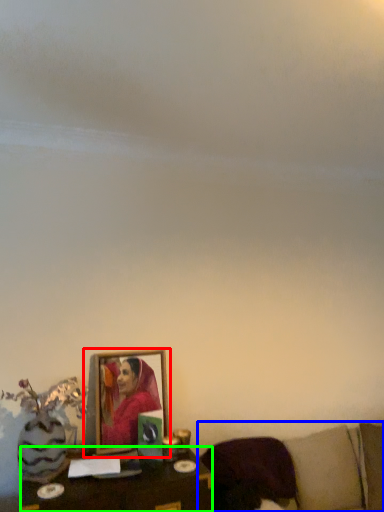
Question: Estimate the real-world distances between objects in this image. Which object is closer to picture frame (highlighted by a red box), furniture (highlighted by a blue box) or table (highlighted by a green box)?

Choices:
 (A) furniture
 (B) table

Answer: (B)